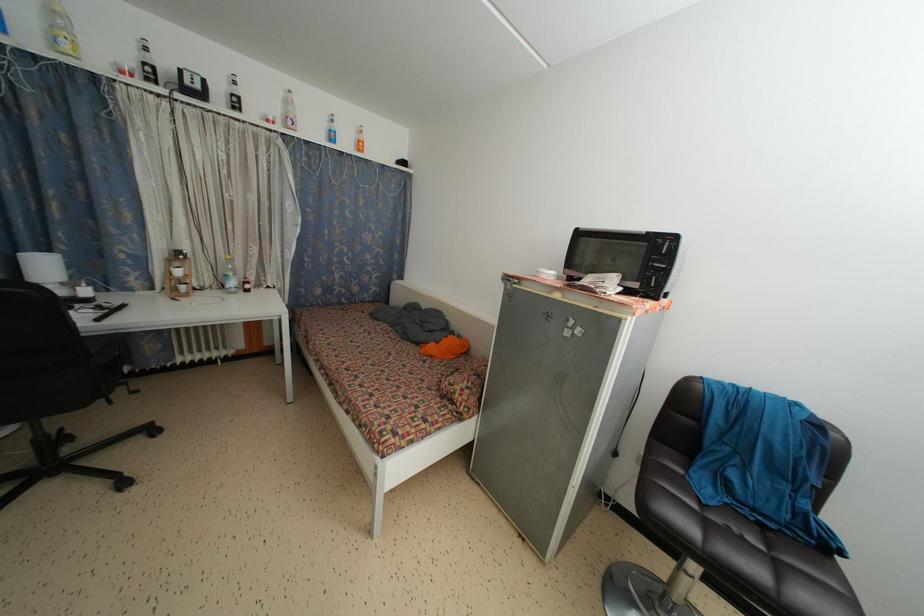
Where would you press the black remote control? Please return your answer as a coordinate pair (x, y).

(110, 312)